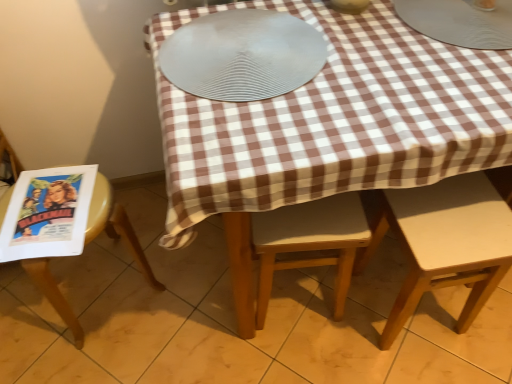
In order to click on free space above matte paper comic book at left (from a real-world perspective) in this screenshot , I will do `click(49, 201)`.